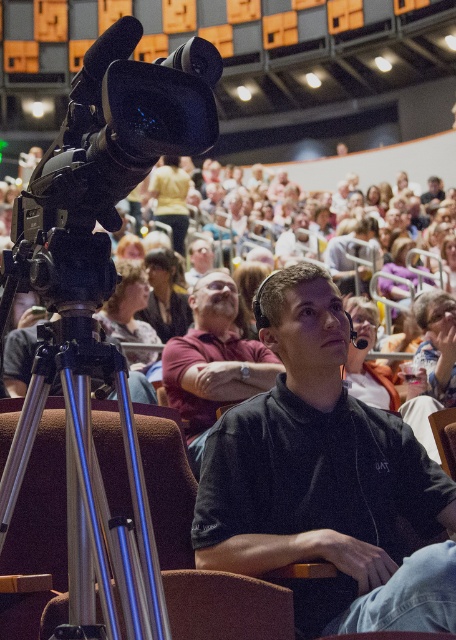
You are an event photographer positioned behind the video camera. You need to capture a photo of both the dark red shirt at center and the dark brown hair at center. Which object should you pan the camera to the right to include first?

The dark red shirt at center is to the right of dark brown hair at center. So to include both in the photo, you should pan the camera to the right first to capture the dark red shirt at center, then adjust to include the dark brown hair at center.

You are a photographer standing behind the camera and want to take a photo of the black matte shirt at center and dark red shirt at center. Which one is on the right side when you look at them through the camera?

The black matte shirt at center is positioned on the right side of dark red shirt at center, so when looking through the camera, the black matte shirt at center is on the right side.